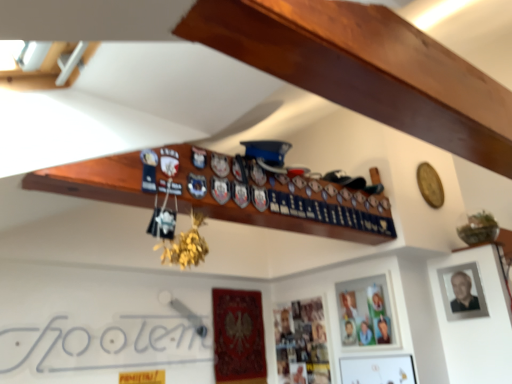
Question: Choose the correct answer: Is white paper at lower left inside matte wooden picture frame at center, which is the second picture frame from left to right, or outside it?

Choices:
 (A) outside
 (B) inside

Answer: (A)

Question: Considering the positions of white paper at lower left and matte wooden picture frame at center, which is the second picture frame from left to right, in the image, is white paper at lower left taller or shorter than matte wooden picture frame at center, which is the second picture frame from left to right,?

Choices:
 (A) short
 (B) tall

Answer: (A)

Question: Which is farther from the matte black photo frame at upper right, arranged as the first picture frame when viewed from the right?

Choices:
 (A) matte wooden picture frame at center, which is the second picture frame from left to right
 (B) metallic silver photo frame at lower center, positioned as the first picture frame in left-to-right order
 (C) white paper at lower left

Answer: (C)

Question: Estimate the real-world distances between objects in this image. Which object is farther from the matte wooden picture frame at center, which is the second picture frame from left to right?

Choices:
 (A) white paper at lower left
 (B) metallic silver photo frame at lower center, which ranks as the third picture frame in right-to-left order
 (C) matte black photo frame at upper right, acting as the 3th picture frame starting from the left

Answer: (A)